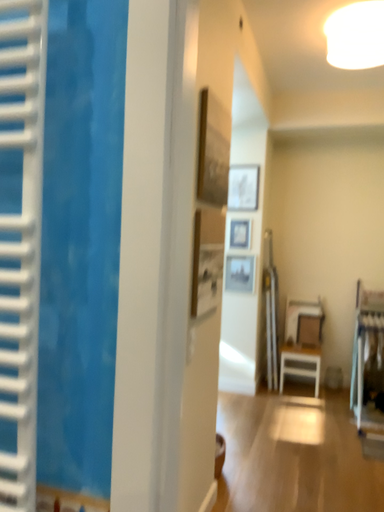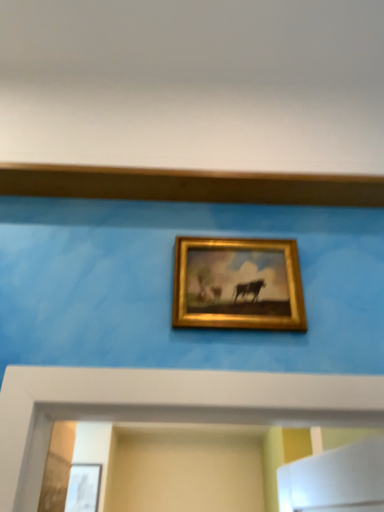
Question: How did the camera likely rotate when shooting the video?

Choices:
 (A) rotated left
 (B) rotated right

Answer: (B)